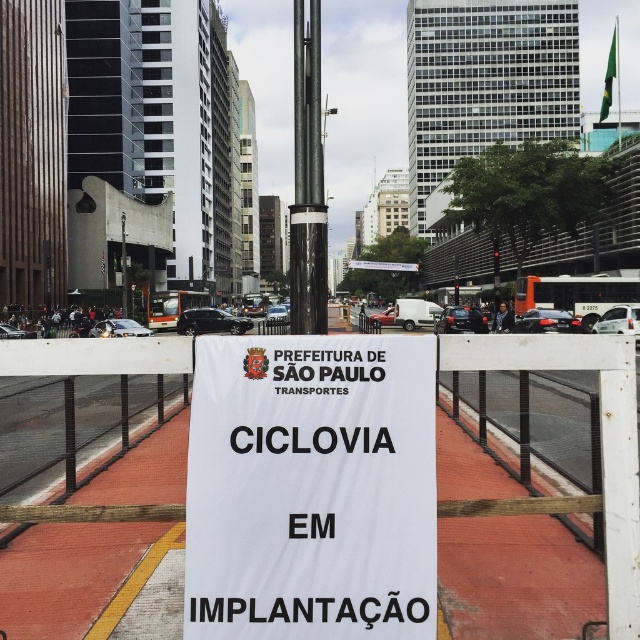
Is white paper sign at center closer to the viewer compared to white mesh fence at center?

Yes, it is.

Is white paper sign at center above white mesh fence at center?

No.

The height and width of the screenshot is (640, 640). Identify the location of white paper sign at center. (310, 488).

Between white paper sign at center and metallic pole at center, which one has more height?

metallic pole at center is taller.

Who is more distant from viewer, (426, 536) or (310, 230)?

The point (310, 230) is more distant.

I want to click on white paper sign at center, so click(310, 488).

Locate an element on the screen. white paper sign at center is located at coordinates (310, 488).

Consider the image. Does white mesh fence at center appear over metallic pole at center?

Incorrect, white mesh fence at center is not positioned above metallic pole at center.

Which is in front, point (460, 337) or point (307, 212)?

Point (460, 337) is more forward.

What do you see at coordinates (600, 436) in the screenshot? I see `white mesh fence at center` at bounding box center [600, 436].

Locate an element on the screen. white mesh fence at center is located at coordinates (600, 436).